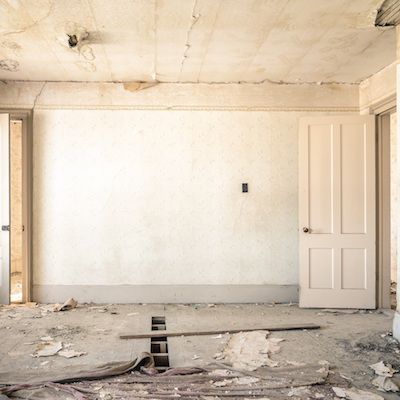
The height and width of the screenshot is (400, 400). In order to click on ceiling in this screenshot , I will do click(131, 66).